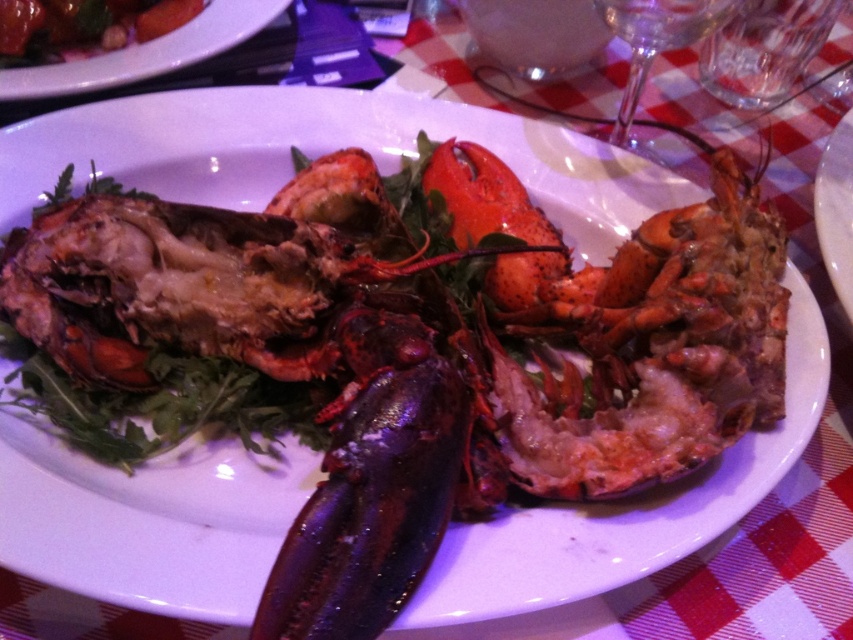
You are a food photographer arranging a lobster dish. You have two lobsters on the plate, the matte black lobster at center and the matte black lobster at upper left. Which lobster should you adjust to ensure proper height for the photo?

The matte black lobster at upper left should be adjusted because the matte black lobster at center is taller than it, so raising or lowering the upper left lobster would balance their heights for the photo.

You are a food critic evaluating the presentation of this dish. The dish has two lobsters, a matte black lobster at center and a matte black lobster at upper left. Which lobster takes up more horizontal space on the plate?

The matte black lobster at center takes up more horizontal space than the matte black lobster at upper left because its width surpasses the other lobster.